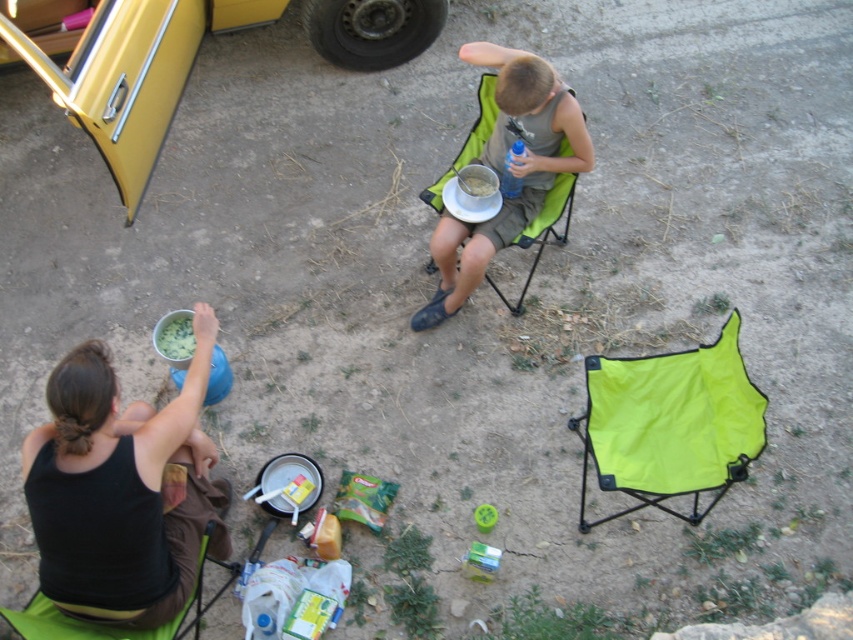
Question: Can you confirm if matte green chair at center is thinner than white matte bowl at upper center?

Choices:
 (A) yes
 (B) no

Answer: (B)

Question: Which point is farther to the camera?

Choices:
 (A) white matte bowl at upper center
 (B) matte green chair at center
 (C) green fabric chair at lower left

Answer: (A)

Question: Observing the image, what is the correct spatial positioning of neon green fabric folding chair at center in reference to green fabric chair at lower left?

Choices:
 (A) left
 (B) right

Answer: (B)

Question: Is neon green fabric folding chair at center above green matte food at lower left?

Choices:
 (A) no
 (B) yes

Answer: (A)

Question: Which object is positioned closest to the green matte food at lower left?

Choices:
 (A) green fabric chair at lower left
 (B) matte green chair at center
 (C) white matte bowl at upper center

Answer: (A)

Question: Which point is farther from the camera taking this photo?

Choices:
 (A) (729, 412)
 (B) (80, 604)

Answer: (A)